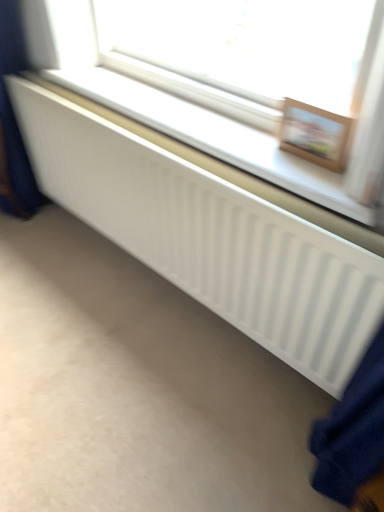
At what (x,y) coordinates should I click in order to perform the action: click on free space in front of wooden picture frame at upper right. Please return your answer as a coordinate pair (x, y). Looking at the image, I should click on (323, 183).